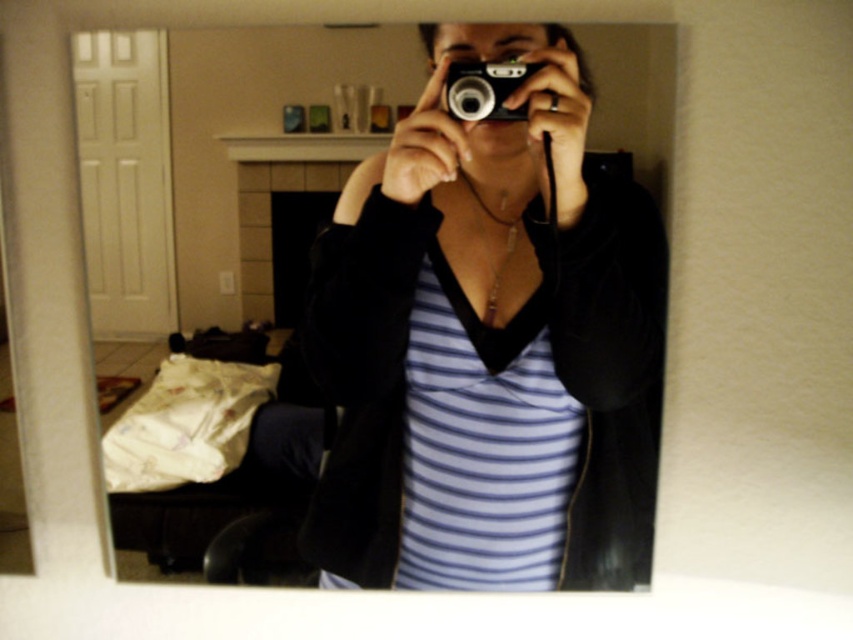
Question: Is matte black camera at center above silver metallic camera at center?

Choices:
 (A) no
 (B) yes

Answer: (A)

Question: Among these objects, which one is nearest to the camera?

Choices:
 (A) matte black camera at center
 (B) silver metallic camera at center

Answer: (A)

Question: Does matte black camera at center have a greater width compared to silver metallic camera at center?

Choices:
 (A) no
 (B) yes

Answer: (B)

Question: Which point is farther to the camera?

Choices:
 (A) (x=627, y=582)
 (B) (x=506, y=115)

Answer: (A)

Question: Does matte black camera at center have a larger size compared to silver metallic camera at center?

Choices:
 (A) no
 (B) yes

Answer: (B)